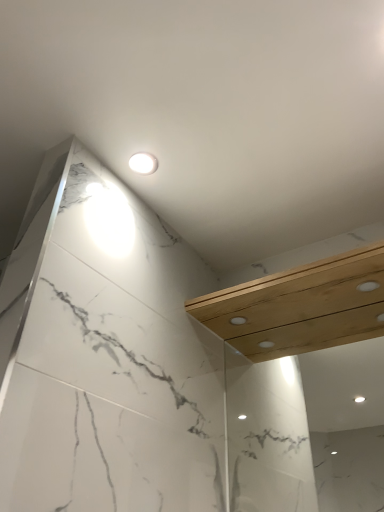
Question: From the image's perspective, is natural wood balustrade at upper right positioned above or below white glossy light fixture at upper center?

Choices:
 (A) above
 (B) below

Answer: (B)

Question: In the image, is natural wood balustrade at upper right positioned in front of or behind white glossy light fixture at upper center?

Choices:
 (A) front
 (B) behind

Answer: (A)

Question: Is natural wood balustrade at upper right wider or thinner than white glossy light fixture at upper center?

Choices:
 (A) wide
 (B) thin

Answer: (A)

Question: Looking at the image, does white glossy light fixture at upper center seem bigger or smaller compared to natural wood balustrade at upper right?

Choices:
 (A) big
 (B) small

Answer: (B)

Question: Is white glossy light fixture at upper center inside the boundaries of natural wood balustrade at upper right, or outside?

Choices:
 (A) inside
 (B) outside

Answer: (B)

Question: Is white glossy light fixture at upper center in front of or behind natural wood balustrade at upper right in the image?

Choices:
 (A) behind
 (B) front

Answer: (A)

Question: In terms of width, does white glossy light fixture at upper center look wider or thinner when compared to natural wood balustrade at upper right?

Choices:
 (A) thin
 (B) wide

Answer: (A)